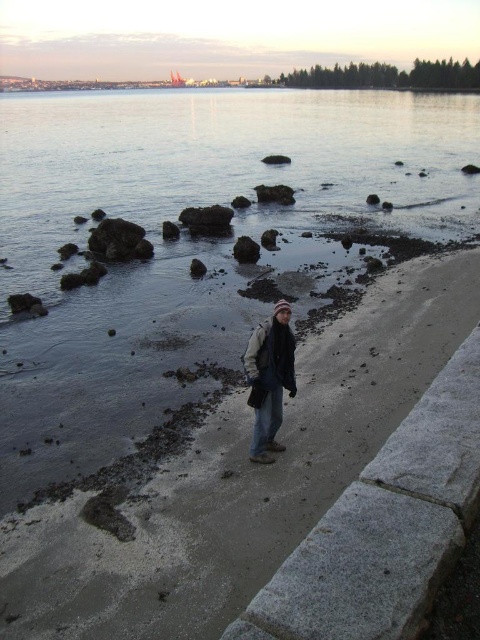
From the picture: Between gray stone pavement at lower right and dark gray knit hat at center, which one is positioned lower?

Positioned lower is gray stone pavement at lower right.

Is gray stone pavement at lower right to the right of dark gray knit hat at center from the viewer's perspective?

Indeed, gray stone pavement at lower right is positioned on the right side of dark gray knit hat at center.

What do you see at coordinates (240, 480) in the screenshot? The image size is (480, 640). I see `gray stone pavement at lower right` at bounding box center [240, 480].

Where is `gray stone pavement at lower right`? This screenshot has height=640, width=480. gray stone pavement at lower right is located at coordinates (240, 480).

Can you confirm if gray stone pavement at lower right is positioned below gray concrete curb at lower right?

Yes.

Is point (381, 310) more distant than point (397, 538)?

Yes, point (381, 310) is behind point (397, 538).

What are the coordinates of `gray stone pavement at lower right` in the screenshot? It's located at (240, 480).

Can you confirm if gray concrete curb at lower right is positioned to the left of dark gray knit hat at center?

In fact, gray concrete curb at lower right is to the right of dark gray knit hat at center.

Which is more to the left, gray concrete curb at lower right or dark gray knit hat at center?

From the viewer's perspective, dark gray knit hat at center appears more on the left side.

Find the location of a particular element. The image size is (480, 640). gray concrete curb at lower right is located at coordinates (385, 525).